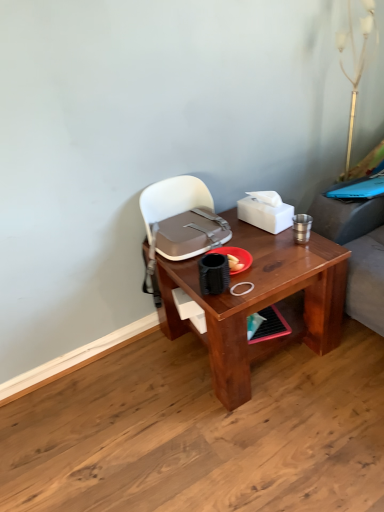
Question: Considering the positions of gold metallic table lamp at upper right and brown wooden desk at center in the image, is gold metallic table lamp at upper right wider or thinner than brown wooden desk at center?

Choices:
 (A) wide
 (B) thin

Answer: (B)

Question: In terms of height, does gold metallic table lamp at upper right look taller or shorter compared to brown wooden desk at center?

Choices:
 (A) short
 (B) tall

Answer: (B)

Question: Which is nearer to the gold metallic table lamp at upper right?

Choices:
 (A) matte gray handbag at center
 (B) white matte tissue box at upper right
 (C) brown wooden desk at center

Answer: (B)

Question: Considering the real-world distances, which object is closest to the matte gray handbag at center?

Choices:
 (A) gold metallic table lamp at upper right
 (B) brown wooden desk at center
 (C) white matte tissue box at upper right

Answer: (C)